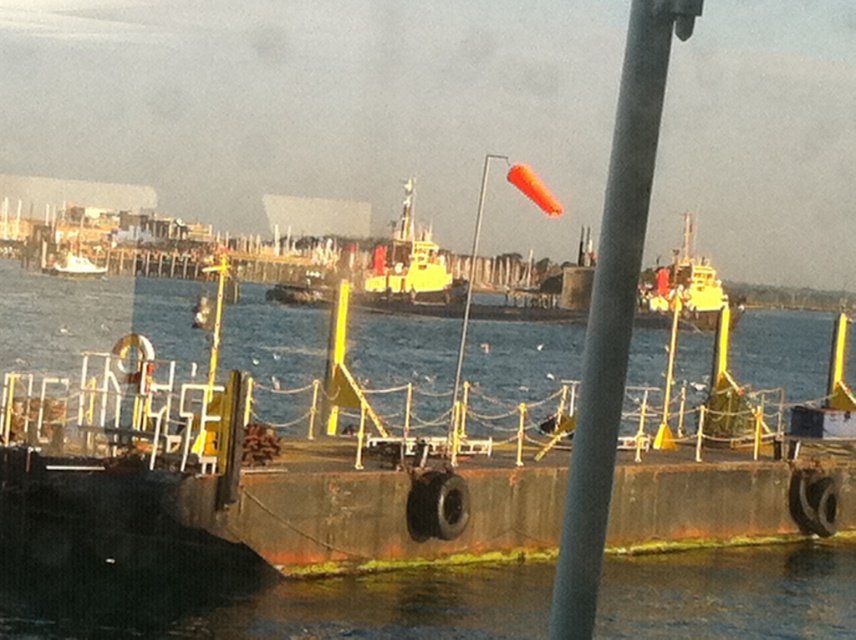
You are a boat captain trying to navigate through the harbor. You see the blue water at center and the metallic gray pole at center. How far apart are these two landmarks?

The blue water at center is 28.89 meters away from the metallic gray pole at center.

You are standing on the dock and see two points in the water. The first point is at coordinates point [275,371] and the second point is at point [64,276]. Which point is closer to you?

Point [275,371] is closer to the viewer than point [64,276].